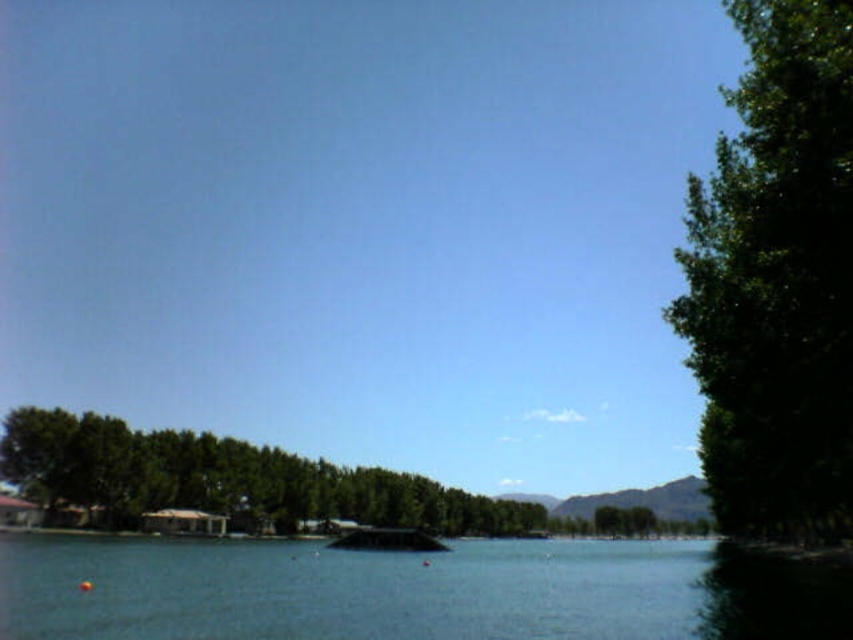
Question: Is green leafy tree at right in front of green leafy trees at center?

Choices:
 (A) no
 (B) yes

Answer: (B)

Question: Which point appears closest to the camera in this image?

Choices:
 (A) (798, 20)
 (B) (297, 602)
 (C) (6, 435)

Answer: (A)

Question: Which point appears farthest from the camera in this image?

Choices:
 (A) (117, 576)
 (B) (761, 236)

Answer: (A)

Question: Estimate the real-world distances between objects in this image. Which object is closer to the green leafy tree at right?

Choices:
 (A) clear blue water at center
 (B) green leafy trees at center

Answer: (A)

Question: Considering the relative positions of green leafy tree at right and green leafy trees at center in the image provided, where is green leafy tree at right located with respect to green leafy trees at center?

Choices:
 (A) above
 (B) below

Answer: (A)

Question: Is green leafy tree at right positioned behind clear blue water at center?

Choices:
 (A) no
 (B) yes

Answer: (A)